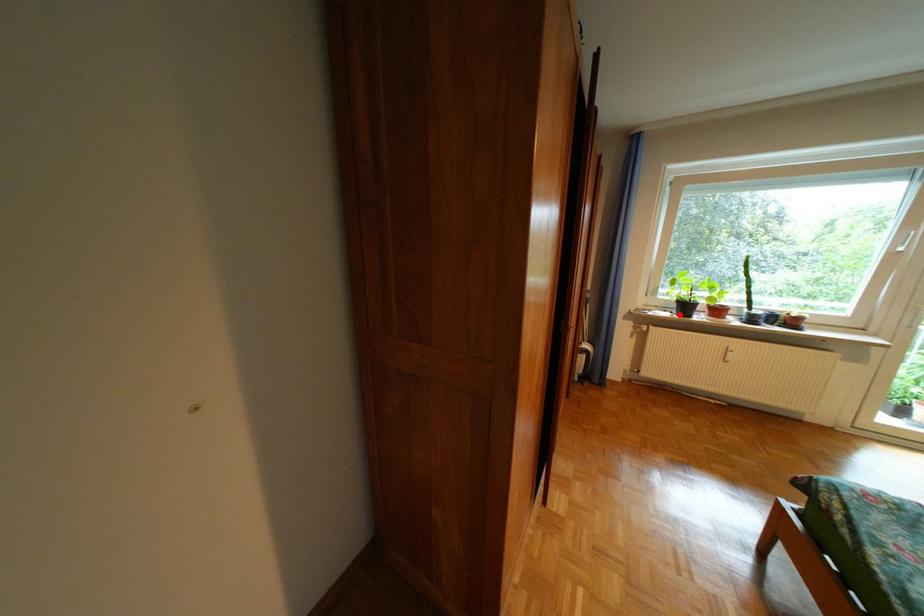
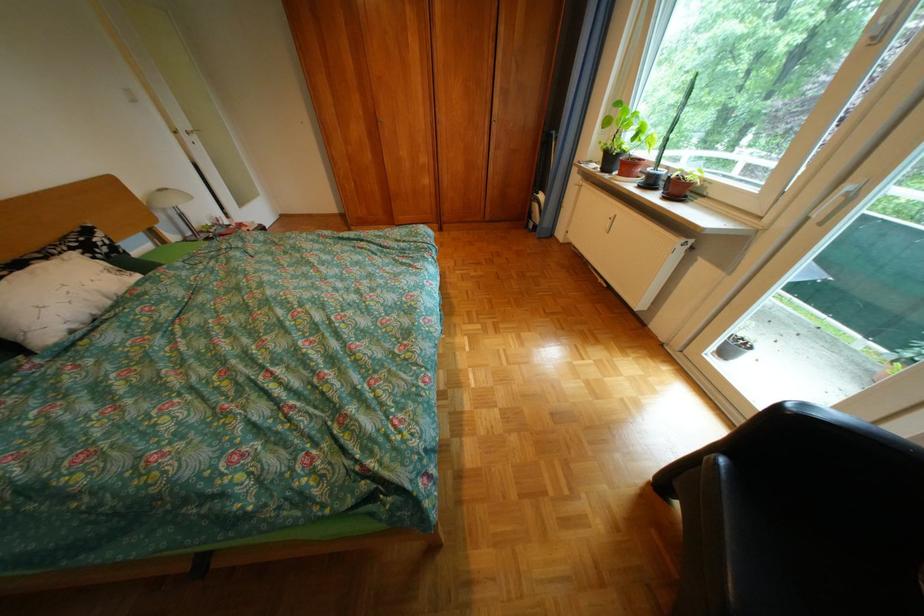
Question: I am providing you with two images of the same scene from different viewpoints. In image1, a red point is highlighted. Considering the same 3D point in image2, which of the following is correct?

Choices:
 (A) It is closer
 (B) It is farther

Answer: (A)